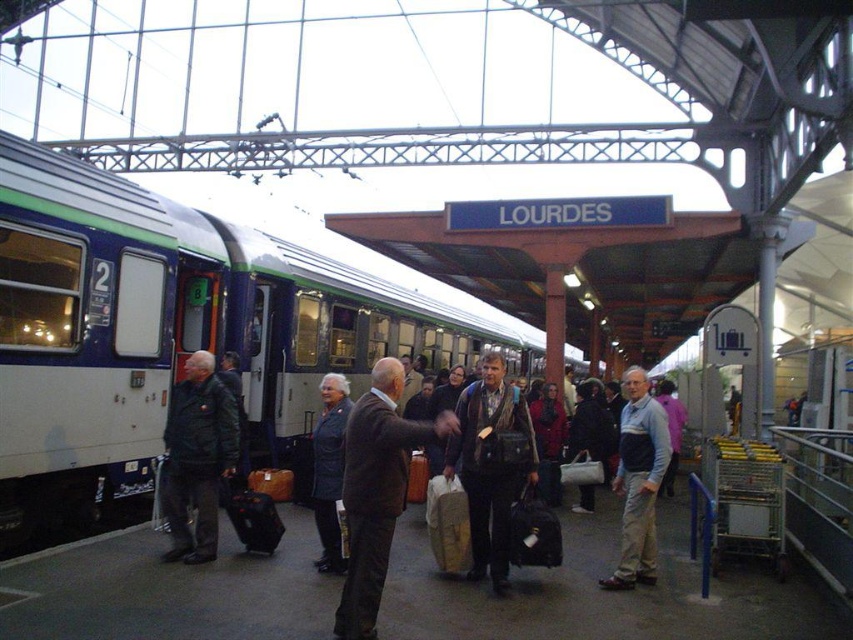
Measure the distance from white glossy train at center to leather backpack at center.

They are 7.34 meters apart.

Is white glossy train at center thinner than leather backpack at center?

In fact, white glossy train at center might be wider than leather backpack at center.

At what (x,y) coordinates should I click in order to perform the action: click on white glossy train at center. Please return your answer as a coordinate pair (x, y). Looking at the image, I should click on (170, 330).

This screenshot has height=640, width=853. In order to click on white glossy train at center in this screenshot , I will do `click(170, 330)`.

This screenshot has width=853, height=640. I want to click on white glossy train at center, so click(170, 330).

Between brown leather jacket at center and dark gray fabric suitcase at center, which one has less height?

dark gray fabric suitcase at center is shorter.

Who is more distant from viewer, (376,454) or (552,516)?

Point (552,516)

Locate an element on the screen. Image resolution: width=853 pixels, height=640 pixels. brown leather jacket at center is located at coordinates point(376,492).